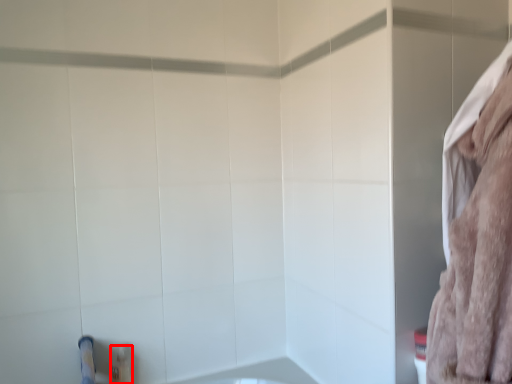
Question: In this image, where is toiletry (annotated by the red box) located relative to bath towel?

Choices:
 (A) right
 (B) left

Answer: (B)